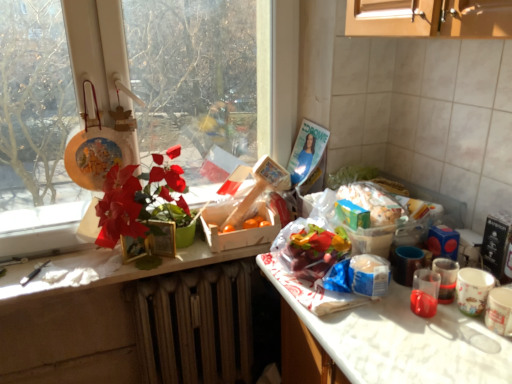
Describe the element at coordinates (136, 200) in the screenshot. I see `matte plastic flower at left` at that location.

Where is `transparent glass window at upper left`? The height and width of the screenshot is (384, 512). transparent glass window at upper left is located at coordinates (179, 75).

This screenshot has width=512, height=384. I want to click on transparent plastic cup at lower right, the 1th coffee cup from the left, so click(x=425, y=292).

Identify the location of translucent plastic container at center. This screenshot has height=384, width=512. (x=373, y=202).

Identify the location of smooth wooden counter at center. Image resolution: width=512 pixels, height=384 pixels. pyautogui.click(x=105, y=269).

Is translucent plastic container at center far away from transparent plastic cup at lower right, the second coffee cup in the right-to-left sequence?

No, translucent plastic container at center is in close proximity to transparent plastic cup at lower right, the second coffee cup in the right-to-left sequence.

Considering the sizes of objects translucent plastic container at center and transparent plastic cup at lower right, the second coffee cup in the right-to-left sequence, in the image provided, who is taller, translucent plastic container at center or transparent plastic cup at lower right, the second coffee cup in the right-to-left sequence,?

With more height is transparent plastic cup at lower right, the second coffee cup in the right-to-left sequence.

Find the location of a particular element. The height and width of the screenshot is (384, 512). the 1st coffee cup below the translucent plastic container at center (from a real-world perspective) is located at coordinates (425, 292).

The image size is (512, 384). In the image, there is a matte plastic flower at left. Find the location of `food below it (from the image's perspective)`. food below it (from the image's perspective) is located at coordinates (373, 202).

Is point (391, 195) positioned after point (104, 206)?

That is True.

Can we say translucent plastic container at center lies outside matte plastic flower at left?

Yes, translucent plastic container at center is not within matte plastic flower at left.

Which of these two, brown textured radiator at lower center or matte plastic flower at left, stands taller?

Standing taller between the two is brown textured radiator at lower center.

Considering the positions of points (248, 288) and (129, 209), is point (248, 288) closer to camera compared to point (129, 209)?

No.

Looking at this image, considering the positions of objects brown textured radiator at lower center and matte plastic flower at left in the image provided, who is behind, brown textured radiator at lower center or matte plastic flower at left?

brown textured radiator at lower center is further from the camera.

Is matte plastic flower at left inside brown textured radiator at lower center?

Actually, matte plastic flower at left is outside brown textured radiator at lower center.

From the image's perspective, between matte plastic flower at left and smooth wooden counter at center, who is located below?

smooth wooden counter at center is shown below in the image.

Is matte plastic flower at left bigger or smaller than smooth wooden counter at center?

Clearly, matte plastic flower at left is larger in size than smooth wooden counter at center.

Considering the relative sizes of matte plastic flower at left and smooth wooden counter at center in the image provided, is matte plastic flower at left wider than smooth wooden counter at center?

Yes, matte plastic flower at left is wider than smooth wooden counter at center.

Is point (101, 255) farther from viewer compared to point (130, 183)?

Yes, point (101, 255) is behind point (130, 183).

Can matte plastic flower at left be found inside smooth wooden counter at center?

No, matte plastic flower at left is not surrounded by smooth wooden counter at center.

How much distance is there between smooth wooden counter at center and matte plastic flower at left?

smooth wooden counter at center is 8.71 inches from matte plastic flower at left.

Relative to matte plastic flower at left, is smooth wooden counter at center in front or behind?

Visually, smooth wooden counter at center is located behind matte plastic flower at left.

Is transparent glass window at upper left not inside brown textured radiator at lower center?

Yes, transparent glass window at upper left is not within brown textured radiator at lower center.

At what (x,y) coordinates should I click in order to perform the action: click on window above the brown textured radiator at lower center (from a real-world perspective). Please return your answer as a coordinate pair (x, y). Looking at the image, I should click on (179, 75).

Is transparent glass window at upper left bigger than brown textured radiator at lower center?

Yes.

What's the angular difference between transparent glass window at upper left and brown textured radiator at lower center's facing directions?

The angular difference between transparent glass window at upper left and brown textured radiator at lower center is 0.05 degrees.

Considering the positions of objects matte plastic flower at left and transparent glass window at upper left in the image provided, who is more to the left, matte plastic flower at left or transparent glass window at upper left?

Positioned to the left is matte plastic flower at left.

From a real-world perspective, relative to transparent glass window at upper left, is matte plastic flower at left vertically above or below?

matte plastic flower at left is below transparent glass window at upper left.

Does point (141, 199) lie in front of point (4, 224)?

No, (141, 199) is behind (4, 224).

Is matte plastic flower at left positioned with its back to transparent glass window at upper left?

Yes, matte plastic flower at left's orientation is away from transparent glass window at upper left.

The width and height of the screenshot is (512, 384). In order to click on coffee cup that is the 1st object directly below the translucent plastic container at center (from a real-world perspective) in this screenshot , I will do `click(425, 292)`.

I want to click on flower that is above the translucent plastic container at center (from the image's perspective), so click(136, 200).

Based on their spatial positions, is matte plastic flower at left or transparent glass window at upper left closer to translucent plastic cup at right, acting as the 1th coffee cup starting from the right?

matte plastic flower at left is positioned closer to the anchor translucent plastic cup at right, acting as the 1th coffee cup starting from the right.

Based on their spatial positions, is transparent glass window at upper left or transparent plastic cup at lower right, the 1th coffee cup from the left, further from translucent plastic cup at right, the 2th coffee cup when ordered from left to right?

transparent glass window at upper left.

When comparing their distances from transparent glass window at upper left, does translucent plastic container at center or brown textured radiator at lower center seem further?

Among the two, translucent plastic container at center is located further to transparent glass window at upper left.

Considering their positions, is transparent plastic cup at lower right, the 1th coffee cup from the left, positioned closer to transparent glass window at upper left than brown textured radiator at lower center?

brown textured radiator at lower center.

Which object lies further to the anchor point smooth wooden counter at center, brown textured radiator at lower center or translucent plastic container at center?

translucent plastic container at center is further to smooth wooden counter at center.

Consider the image. From the image, which object appears to be farther from translucent plastic cup at right, the 2th coffee cup when ordered from left to right, brown textured radiator at lower center or transparent glass window at upper left?

Based on the image, transparent glass window at upper left appears to be further to translucent plastic cup at right, the 2th coffee cup when ordered from left to right.

From the image, which object appears to be nearer to translucent plastic container at center, smooth wooden counter at center or matte plastic flower at left?

The object closer to translucent plastic container at center is matte plastic flower at left.

Considering their positions, is brown textured radiator at lower center positioned further to translucent plastic cup at right, acting as the 1th coffee cup starting from the right, than transparent plastic cup at lower right, the 1th coffee cup from the left?

Based on the image, brown textured radiator at lower center appears to be further to translucent plastic cup at right, acting as the 1th coffee cup starting from the right.

Identify the location of window between smooth wooden counter at center and translucent plastic container at center in the horizontal direction. The height and width of the screenshot is (384, 512). (179, 75).

Where is `food between transparent glass window at upper left and transparent plastic cup at lower right, the second coffee cup in the right-to-left sequence`? food between transparent glass window at upper left and transparent plastic cup at lower right, the second coffee cup in the right-to-left sequence is located at coordinates (373, 202).

At what (x,y) coordinates should I click in order to perform the action: click on flower situated between smooth wooden counter at center and translucent plastic container at center from left to right. Please return your answer as a coordinate pair (x, y). This screenshot has height=384, width=512. Looking at the image, I should click on (136, 200).

Identify the location of coffee cup between translucent plastic container at center and transparent plastic cup at lower right, the 1th coffee cup from the left, in the up-down direction. (446, 278).